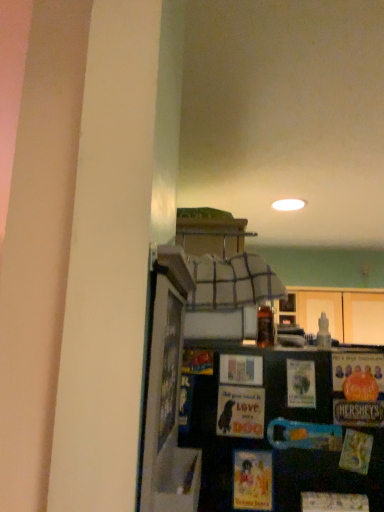
Question: From the image's perspective, does matte paper postcard at center, which is the 2th postcard in right-to-left order, appear lower than translucent glass bottle at upper center?

Choices:
 (A) no
 (B) yes

Answer: (B)

Question: Is matte paper postcard at center, arranged as the 1th postcard when viewed from the left, turned away from translucent glass bottle at upper center?

Choices:
 (A) yes
 (B) no

Answer: (B)

Question: Is matte paper postcard at center, arranged as the 1th postcard when viewed from the left, in front of translucent glass bottle at upper center?

Choices:
 (A) no
 (B) yes

Answer: (B)

Question: Does matte paper postcard at center, which is the 2th postcard in right-to-left order, have a greater height compared to translucent glass bottle at upper center?

Choices:
 (A) yes
 (B) no

Answer: (A)

Question: From a real-world perspective, is matte paper postcard at center, which is the 2th postcard in right-to-left order, physically above translucent glass bottle at upper center?

Choices:
 (A) yes
 (B) no

Answer: (B)

Question: From a real-world perspective, relative to matte paper postcard at center, the 2th postcard in the left-to-right sequence, is translucent glass bottle at upper center vertically above or below?

Choices:
 (A) above
 (B) below

Answer: (A)

Question: From the image's perspective, is translucent glass bottle at upper center located above or below matte paper postcard at center, the 2th postcard in the left-to-right sequence?

Choices:
 (A) below
 (B) above

Answer: (B)

Question: Is point (327, 347) closer or farther from the camera than point (288, 406)?

Choices:
 (A) farther
 (B) closer

Answer: (A)

Question: Considering the positions of translucent glass bottle at upper center and matte paper postcard at center, the 2th postcard in the left-to-right sequence, in the image, is translucent glass bottle at upper center wider or thinner than matte paper postcard at center, the 2th postcard in the left-to-right sequence,?

Choices:
 (A) thin
 (B) wide

Answer: (B)

Question: Considering the positions of matte paper postcard at center, marked as the 1th postcard in a right-to-left arrangement, and matte paper postcard at center, arranged as the 1th postcard when viewed from the left, in the image, is matte paper postcard at center, marked as the 1th postcard in a right-to-left arrangement, wider or thinner than matte paper postcard at center, arranged as the 1th postcard when viewed from the left,?

Choices:
 (A) wide
 (B) thin

Answer: (A)

Question: In the image, is matte paper postcard at center, the 2th postcard in the left-to-right sequence, positioned in front of or behind matte paper postcard at center, arranged as the 1th postcard when viewed from the left?

Choices:
 (A) behind
 (B) front

Answer: (A)

Question: Considering the positions of matte paper postcard at center, marked as the 1th postcard in a right-to-left arrangement, and matte paper postcard at center, arranged as the 1th postcard when viewed from the left, in the image, is matte paper postcard at center, marked as the 1th postcard in a right-to-left arrangement, bigger or smaller than matte paper postcard at center, arranged as the 1th postcard when viewed from the left,?

Choices:
 (A) small
 (B) big

Answer: (A)

Question: Is matte paper postcard at center, the 2th postcard in the left-to-right sequence, spatially inside matte paper postcard at center, which is the 2th postcard in right-to-left order, or outside of it?

Choices:
 (A) inside
 (B) outside

Answer: (B)

Question: From the image's perspective, is matte paper postcard at center, arranged as the 1th postcard when viewed from the left, positioned above or below matte paper postcard at center, the 2th postcard in the left-to-right sequence?

Choices:
 (A) below
 (B) above

Answer: (A)

Question: Is matte paper postcard at center, arranged as the 1th postcard when viewed from the left, situated inside matte paper postcard at center, the 2th postcard in the left-to-right sequence, or outside?

Choices:
 (A) outside
 (B) inside

Answer: (A)